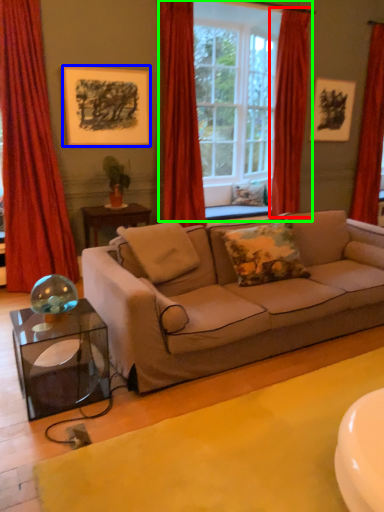
Question: Which object is positioned closest to curtain (highlighted by a red box)? Select from picture frame (highlighted by a blue box) and window (highlighted by a green box).

Choices:
 (A) picture frame
 (B) window

Answer: (B)